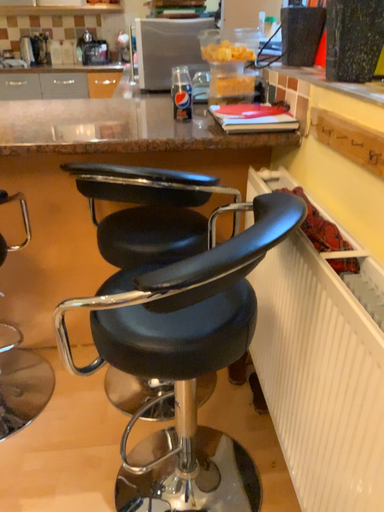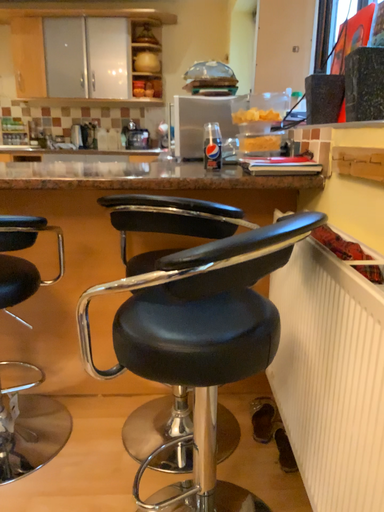
Question: Which way did the camera rotate in the video?

Choices:
 (A) rotated upward
 (B) rotated downward

Answer: (A)